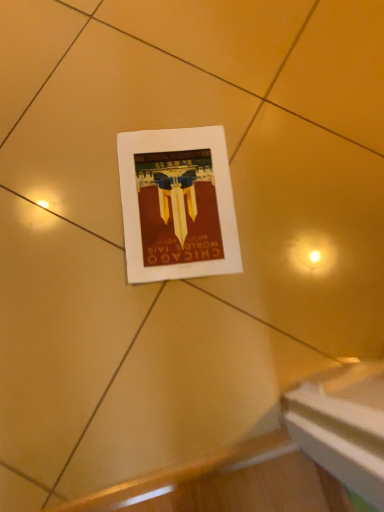
In order to click on blank space above white paper at center (from a real-world perspective) in this screenshot , I will do `click(175, 199)`.